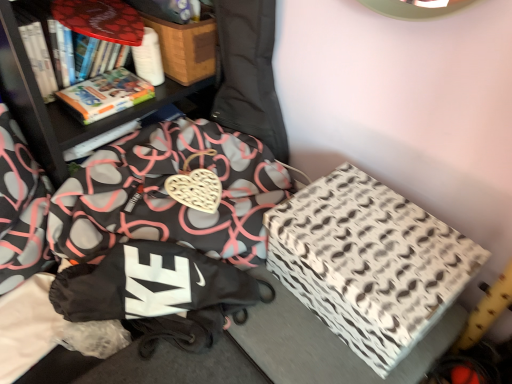
Question: Is the position of black fabric bag at lower left less distant than that of hardcover book at upper left?

Choices:
 (A) yes
 (B) no

Answer: (A)

Question: Does black fabric bag at lower left contain hardcover book at upper left?

Choices:
 (A) no
 (B) yes

Answer: (A)

Question: Is black fabric bag at lower left facing towards hardcover book at upper left?

Choices:
 (A) no
 (B) yes

Answer: (A)

Question: Considering the relative positions of black fabric bag at lower left and hardcover book at upper left in the image provided, is black fabric bag at lower left to the right of hardcover book at upper left from the viewer's perspective?

Choices:
 (A) no
 (B) yes

Answer: (A)

Question: From a real-world perspective, is black fabric bag at lower left over hardcover book at upper left?

Choices:
 (A) yes
 (B) no

Answer: (B)

Question: Would you say black fabric bag at lower left is to the left or to the right of wooden box at upper center, which appears as the 1th cardboard box when viewed from the left, in the picture?

Choices:
 (A) right
 (B) left

Answer: (B)

Question: Based on their sizes in the image, would you say black fabric bag at lower left is bigger or smaller than wooden box at upper center, the first cardboard box when ordered from top to bottom?

Choices:
 (A) small
 (B) big

Answer: (B)

Question: Is black fabric bag at lower left inside or outside of wooden box at upper center, positioned as the 2th cardboard box in bottom-to-top order?

Choices:
 (A) outside
 (B) inside

Answer: (A)

Question: From a real-world perspective, relative to wooden box at upper center, the second cardboard box in the right-to-left sequence, is black fabric bag at lower left vertically above or below?

Choices:
 (A) above
 (B) below

Answer: (B)

Question: Is black fabric bag at lower left wider or thinner than white-patterned cardboard box at right, acting as the 1th cardboard box starting from the bottom?

Choices:
 (A) thin
 (B) wide

Answer: (B)

Question: In terms of height, does black fabric bag at lower left look taller or shorter compared to white-patterned cardboard box at right, positioned as the 2th cardboard box in top-to-bottom order?

Choices:
 (A) short
 (B) tall

Answer: (B)

Question: From the image's perspective, is black fabric bag at lower left located above or below white-patterned cardboard box at right, the second cardboard box viewed from the left?

Choices:
 (A) above
 (B) below

Answer: (A)

Question: Based on their sizes in the image, would you say black fabric bag at lower left is bigger or smaller than white-patterned cardboard box at right, the 1th cardboard box viewed from the right?

Choices:
 (A) small
 (B) big

Answer: (B)

Question: Visually, is wooden box at upper center, positioned as the 2th cardboard box in bottom-to-top order, positioned to the left or to the right of black fabric bag at lower left?

Choices:
 (A) right
 (B) left

Answer: (A)

Question: Considering the positions of wooden box at upper center, the second cardboard box in the right-to-left sequence, and black fabric bag at lower left in the image, is wooden box at upper center, the second cardboard box in the right-to-left sequence, taller or shorter than black fabric bag at lower left?

Choices:
 (A) short
 (B) tall

Answer: (A)